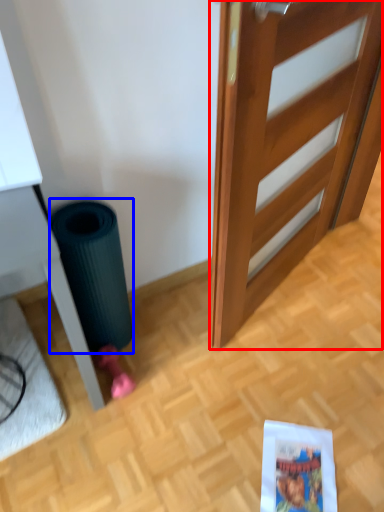
Question: Which of the following is the farthest to the observer, door (highlighted by a red box) or garbage (highlighted by a blue box)?

Choices:
 (A) door
 (B) garbage

Answer: (B)